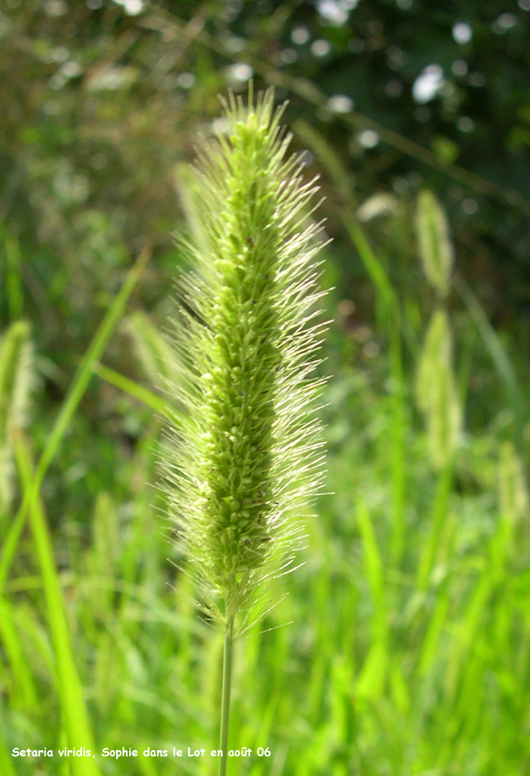
The width and height of the screenshot is (530, 776). What are the coordinates of `bottom of plant` in the screenshot? It's located at (229, 618).